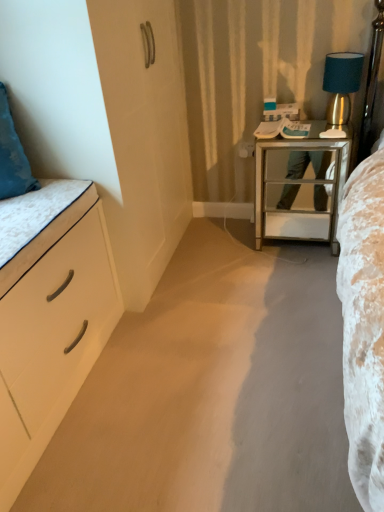
Image resolution: width=384 pixels, height=512 pixels. I want to click on vacant space in front of mirrored glass nightstand at center right, so click(297, 275).